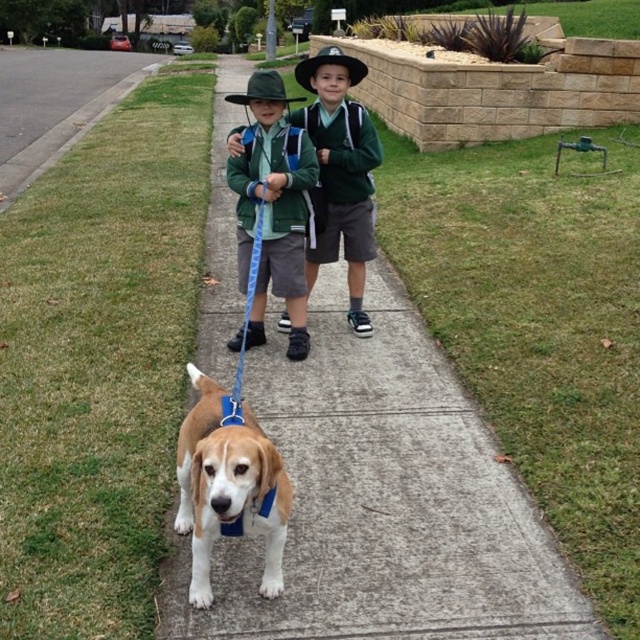
You are standing in front of the image and want to know how far the point at coordinates point (396, 276) is from your eyes. Can you determine the distance?

The point (396, 276) is 5.08 meters from the camera, so the distance from your eyes to the point (396, 276) is approximately 5.08 meters.

You are a photographer standing in front of the two boys and the dog. You want to take a photo where the brown matte dog at center is visible above the green matte uniform at center. Is this possible with your current position?

The brown matte dog at center is located below the green matte uniform at center, so it is not possible to take a photo from your current position where the brown matte dog at center is visible above the green matte uniform at center.

You are standing at the point marked at coordinates (384, 499). Looking around, you see the scene described. What material are you standing on?

The concrete at center is located at point (384, 499), so you are standing on concrete.